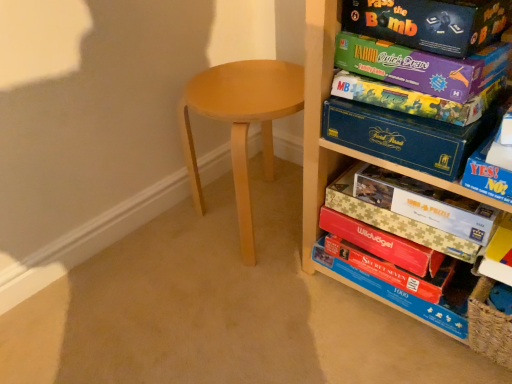
Question: Can you confirm if red matte puzzle box at lower right, the 1th paperback book from the bottom, is thinner than blue cardboard box at right?

Choices:
 (A) yes
 (B) no

Answer: (A)

Question: Is red matte puzzle box at lower right, the 6th paperback book in the top-to-bottom sequence, bigger than blue cardboard box at right?

Choices:
 (A) no
 (B) yes

Answer: (A)

Question: Is red matte puzzle box at lower right, the 6th paperback book in the top-to-bottom sequence, outside of blue cardboard box at right?

Choices:
 (A) yes
 (B) no

Answer: (A)

Question: From the image's perspective, would you say red matte puzzle box at lower right, the 6th paperback book in the top-to-bottom sequence, is shown under blue cardboard box at right?

Choices:
 (A) no
 (B) yes

Answer: (B)

Question: Are red matte puzzle box at lower right, the 6th paperback book in the top-to-bottom sequence, and blue cardboard box at right beside each other?

Choices:
 (A) yes
 (B) no

Answer: (B)

Question: Looking at the image, does wooden shelf at right seem bigger or smaller compared to matte black game box at upper right, which is the first paperback book in top-to-bottom order?

Choices:
 (A) big
 (B) small

Answer: (A)

Question: Considering the positions of wooden shelf at right and matte black game box at upper right, arranged as the sixth paperback book when ordered from the bottom, in the image, is wooden shelf at right taller or shorter than matte black game box at upper right, arranged as the sixth paperback book when ordered from the bottom,?

Choices:
 (A) tall
 (B) short

Answer: (A)

Question: Which is correct: wooden shelf at right is inside matte black game box at upper right, arranged as the sixth paperback book when ordered from the bottom, or outside of it?

Choices:
 (A) inside
 (B) outside

Answer: (B)

Question: From a real-world perspective, is wooden shelf at right physically located above or below matte black game box at upper right, arranged as the sixth paperback book when ordered from the bottom?

Choices:
 (A) above
 (B) below

Answer: (B)

Question: Considering the positions of wooden shelf at right and beige cardboard puzzle at center-right, the 5th paperback book viewed from the top, in the image, is wooden shelf at right wider or thinner than beige cardboard puzzle at center-right, the 5th paperback book viewed from the top,?

Choices:
 (A) thin
 (B) wide

Answer: (B)

Question: Looking at the image, does wooden shelf at right seem bigger or smaller compared to beige cardboard puzzle at center-right, the 5th paperback book viewed from the top?

Choices:
 (A) small
 (B) big

Answer: (B)

Question: In terms of height, does wooden shelf at right look taller or shorter compared to beige cardboard puzzle at center-right, the 2th paperback book from the bottom?

Choices:
 (A) tall
 (B) short

Answer: (A)

Question: Is wooden shelf at right inside the boundaries of beige cardboard puzzle at center-right, the 5th paperback book viewed from the top, or outside?

Choices:
 (A) outside
 (B) inside

Answer: (A)

Question: Considering the positions of blue cardboard box at right and wooden shelf at right in the image, is blue cardboard box at right taller or shorter than wooden shelf at right?

Choices:
 (A) short
 (B) tall

Answer: (A)

Question: Does point (476, 152) appear closer or farther from the camera than point (387, 301)?

Choices:
 (A) closer
 (B) farther

Answer: (A)